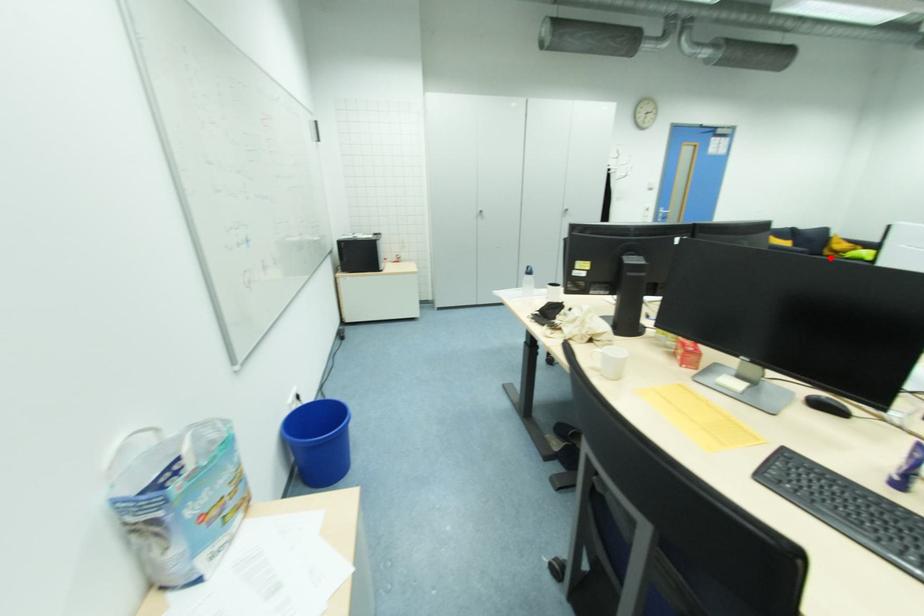
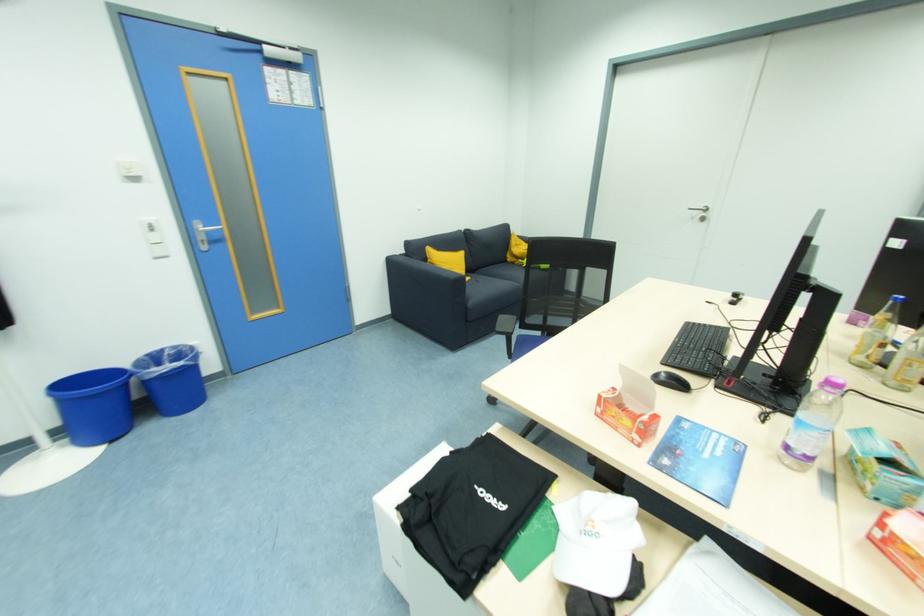
Question: A red point is marked in image1. In image2, is the corresponding 3D point closer to the camera or farther? Reply with the corresponding letter.

Choices:
 (A) The corresponding 3D point is closer.
 (B) The corresponding 3D point is farther.

Answer: (A)